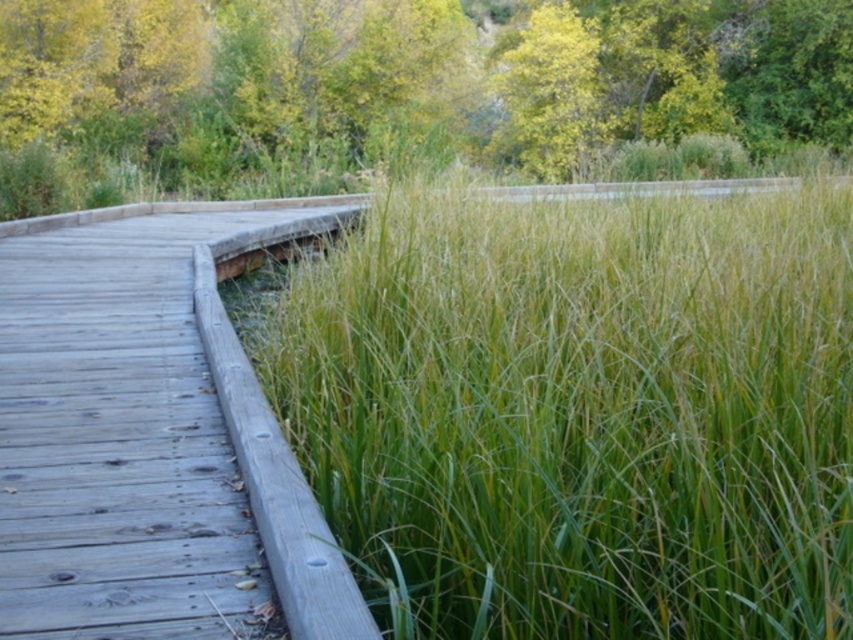
Which is more to the left, green grass at center or green leafy tree at upper center?

green leafy tree at upper center

Locate an element on the screen. Image resolution: width=853 pixels, height=640 pixels. green grass at center is located at coordinates (579, 413).

The height and width of the screenshot is (640, 853). I want to click on green grass at center, so click(579, 413).

I want to click on green grass at center, so click(x=579, y=413).

Can you confirm if green leafy tree at upper center is positioned to the left of weathered wood path at left?

Incorrect, green leafy tree at upper center is not on the left side of weathered wood path at left.

Who is more distant from viewer, (758, 13) or (78, 257)?

Positioned behind is point (758, 13).

Where is `green leafy tree at upper center`? green leafy tree at upper center is located at coordinates (407, 92).

Does green grass at center appear on the left side of weathered wood path at left?

Incorrect, green grass at center is not on the left side of weathered wood path at left.

Between green grass at center and weathered wood path at left, which one has less height?

With less height is green grass at center.

What do you see at coordinates (579, 413) in the screenshot?
I see `green grass at center` at bounding box center [579, 413].

This screenshot has width=853, height=640. Identify the location of green grass at center. (579, 413).